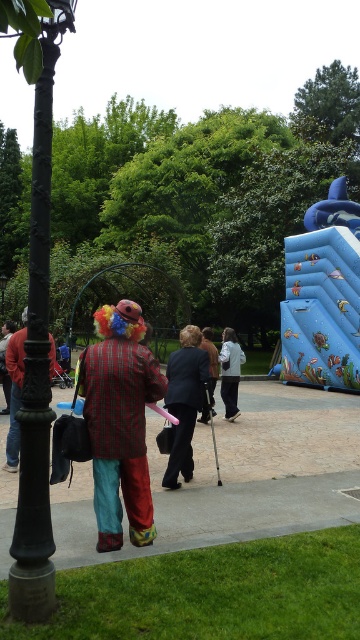
Question: Which point is closer to the camera?

Choices:
 (A) (339, 292)
 (B) (214, 360)

Answer: (B)

Question: Can you confirm if black wrought iron lamp post at left is wider than plaid fabric clown at center?

Choices:
 (A) no
 (B) yes

Answer: (B)

Question: Which point is farther to the camera?

Choices:
 (A) plaid fabric clown at left
 (B) plaid fabric clown at center
 (C) light gray fabric jacket at center
 (D) dark blue suit at center

Answer: (C)

Question: Considering the real-world distances, which object is closest to the dark blue suit at center?

Choices:
 (A) plaid fabric clown at left
 (B) light gray fabric jacket at center
 (C) dark gray suit at center

Answer: (C)

Question: Does plaid fabric clown at left have a larger size compared to light gray fabric jacket at center?

Choices:
 (A) no
 (B) yes

Answer: (A)

Question: From the image, what is the correct spatial relationship of light gray fabric jacket at center in relation to dark gray suit at center?

Choices:
 (A) above
 (B) below

Answer: (B)